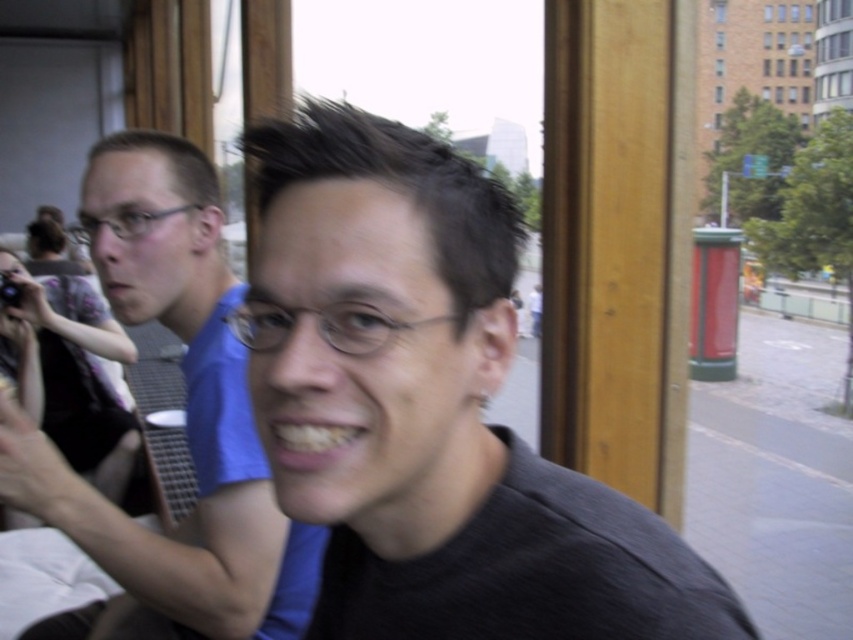
Question: Does matte black shirt at center have a smaller size compared to matte black camera at left?

Choices:
 (A) yes
 (B) no

Answer: (A)

Question: Which object appears closest to the camera in this image?

Choices:
 (A) matte black shirt at center
 (B) matte black camera at left
 (C) blue fabric shirt at left

Answer: (A)

Question: Which of the following is the farthest from the observer?

Choices:
 (A) blue fabric shirt at left
 (B) matte black camera at left
 (C) matte black shirt at center

Answer: (B)

Question: Does blue fabric shirt at left have a smaller size compared to matte black camera at left?

Choices:
 (A) no
 (B) yes

Answer: (B)

Question: Based on their relative distances, which object is nearer to the matte black shirt at center?

Choices:
 (A) blue fabric shirt at left
 (B) matte black camera at left

Answer: (A)

Question: Can you confirm if matte black shirt at center is bigger than blue fabric shirt at left?

Choices:
 (A) no
 (B) yes

Answer: (A)